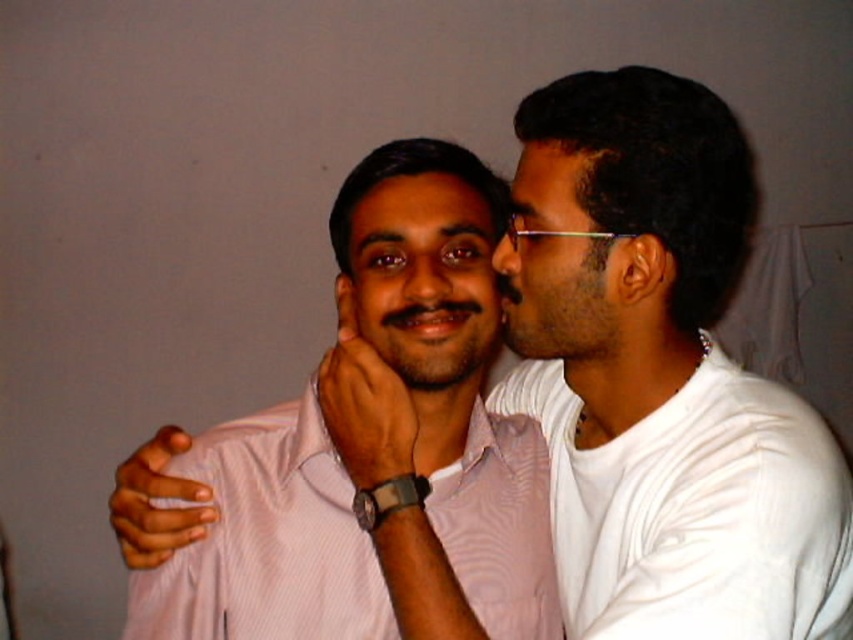
Question: Which object appears closest to the camera in this image?

Choices:
 (A) matte black face at upper right
 (B) white cotton dress shirt at right
 (C) pink striped dress shirt at center
 (D) matte pink shirt at center

Answer: (B)

Question: Where is pink striped dress shirt at center located in relation to matte pink shirt at center in the image?

Choices:
 (A) left
 (B) right

Answer: (A)

Question: Which object is the farthest from the pink striped dress shirt at center?

Choices:
 (A) matte black face at upper right
 (B) white cotton dress shirt at right

Answer: (A)

Question: Is white cotton dress shirt at right above matte pink shirt at center?

Choices:
 (A) no
 (B) yes

Answer: (A)

Question: Which point appears farthest from the camera in this image?

Choices:
 (A) (311, 544)
 (B) (769, 616)
 (C) (468, 256)

Answer: (C)

Question: Does matte pink shirt at center have a larger size compared to matte black face at upper right?

Choices:
 (A) no
 (B) yes

Answer: (B)